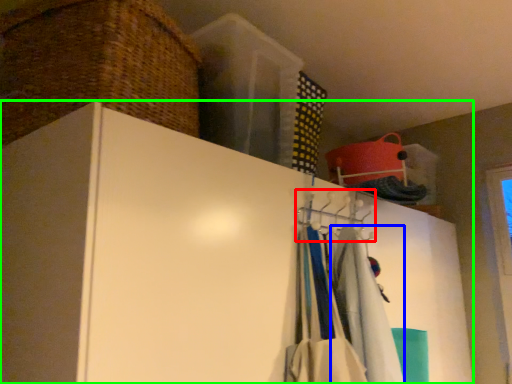
Question: Estimate the real-world distances between objects in this image. Which object is farther from hanger (highlighted by a red box), clothing (highlighted by a blue box) or cupboard (highlighted by a green box)?

Choices:
 (A) clothing
 (B) cupboard

Answer: (B)